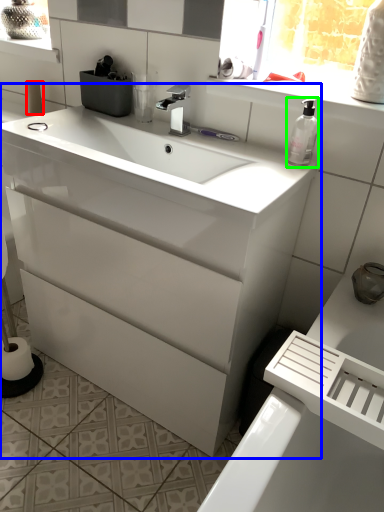
Question: Based on their relative distances, which object is farther from toilet paper (highlighted by a red box)? Choose from bathroom cabinet (highlighted by a blue box) and soap dispenser (highlighted by a green box).

Choices:
 (A) bathroom cabinet
 (B) soap dispenser

Answer: (B)